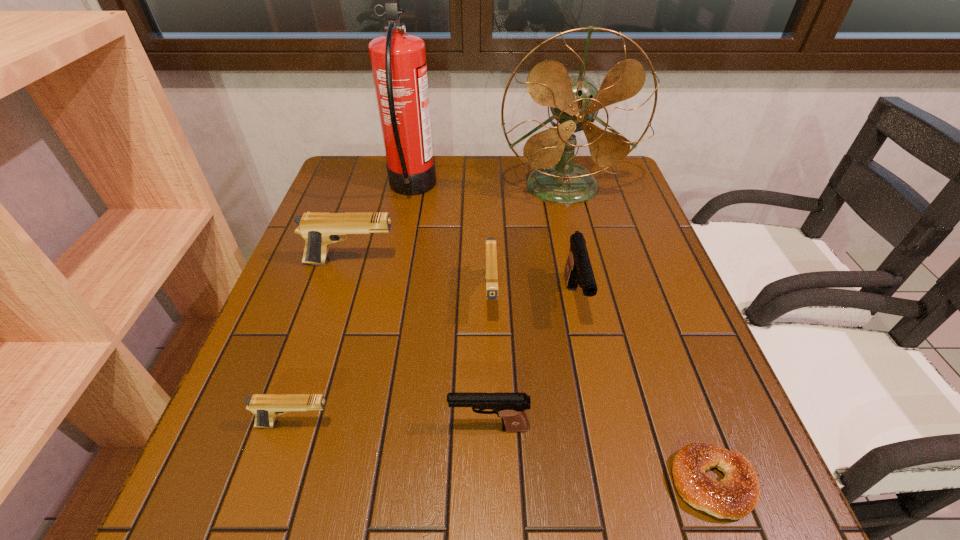
The image size is (960, 540). In order to click on object that is at the near right corner in this screenshot , I will do click(x=733, y=497).

The width and height of the screenshot is (960, 540). Find the location of `blank space at the far edge of the desktop`. blank space at the far edge of the desktop is located at coordinates (444, 187).

I want to click on free space at the near edge, so click(484, 474).

At what (x,y) coordinates should I click in order to perform the action: click on vacant point at the left edge. Please return your answer as a coordinate pair (x, y). This screenshot has height=540, width=960. Looking at the image, I should click on (286, 453).

This screenshot has height=540, width=960. In order to click on free spot at the right edge of the desktop in this screenshot , I will do `click(630, 335)`.

This screenshot has width=960, height=540. In the image, there is a desktop. What are the coordinates of `free region at the far right corner` in the screenshot? It's located at (601, 190).

The image size is (960, 540). What are the coordinates of `blank region between the bigger black pistol and the second nearest tan pistol` in the screenshot? It's located at (533, 299).

Where is `vacant space in between the smaller black pistol and the fan`? This screenshot has width=960, height=540. vacant space in between the smaller black pistol and the fan is located at coordinates (525, 307).

Where is `free spot between the shortest pistol and the fire extinguisher`? This screenshot has height=540, width=960. free spot between the shortest pistol and the fire extinguisher is located at coordinates (354, 306).

Find the location of a particular element. This screenshot has width=960, height=540. vacant area between the smaller black pistol and the fan is located at coordinates (x=525, y=307).